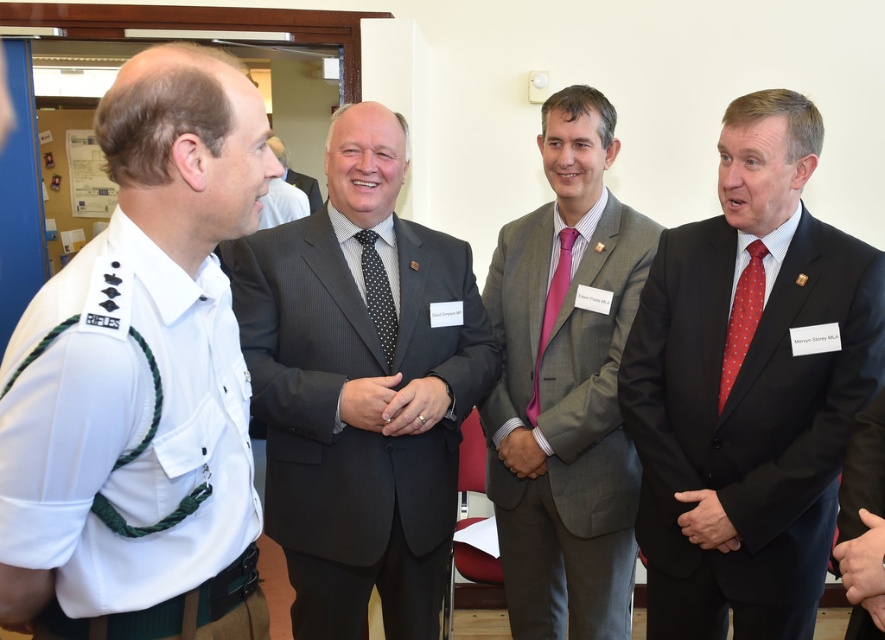
You are a photographer standing in the room where the group of men is conversing. You want to capture a closeup shot of the green fabric hand at lower left and the smooth leather hand at center without any obstructions. Given that your camera has a focal length of 50mm and a sensor size of 24x36mm, what is the minimum distance you need to stand from the subjects to ensure both hands are in frame and clearly visible?

The green fabric hand at lower left is 4.22 feet away from the smooth leather hand at center. To capture both hands in frame with a 50mm lens and 24x36mm sensor, the minimum distance required would be calculated using the formula for field of view. The horizontal FOV at 50mm is approximately 39 degrees. Using trigonometry, the distance needed to cover 4.22 feet within this angle would be roughly 6.5 feet. Therefore, standing at least 6.5 feet away ensures both hands are in frame without obstruction.

You are observing a group of men in a formal setting. You notice two hands in the scene. The first is the green fabric hand at lower left, and the second is the smooth leather hand at center. Which hand appears taller in the image?

The green fabric hand at lower left appears taller than the smooth leather hand at center in the image.

You are observing a group of men in a formal setting. You notice two distinct hands at the center of the image, one labeled as the black leather hand at center and the other as the smooth leather hand at center. Which of these two hands is positioned lower in the image?

The black leather hand at center is positioned below the smooth leather hand at center, so it is the lower one.